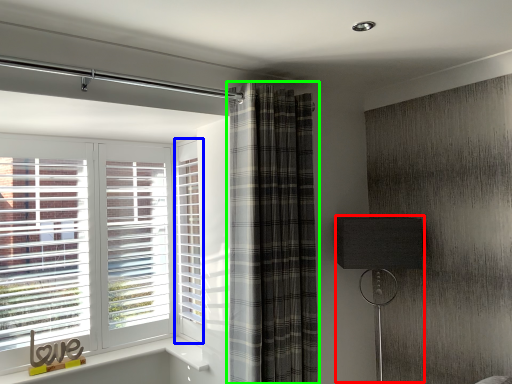
Question: Which object is positioned closest to table lamp (highlighted by a red box)? Select from screen door (highlighted by a blue box) and curtain (highlighted by a green box).

Choices:
 (A) screen door
 (B) curtain

Answer: (B)